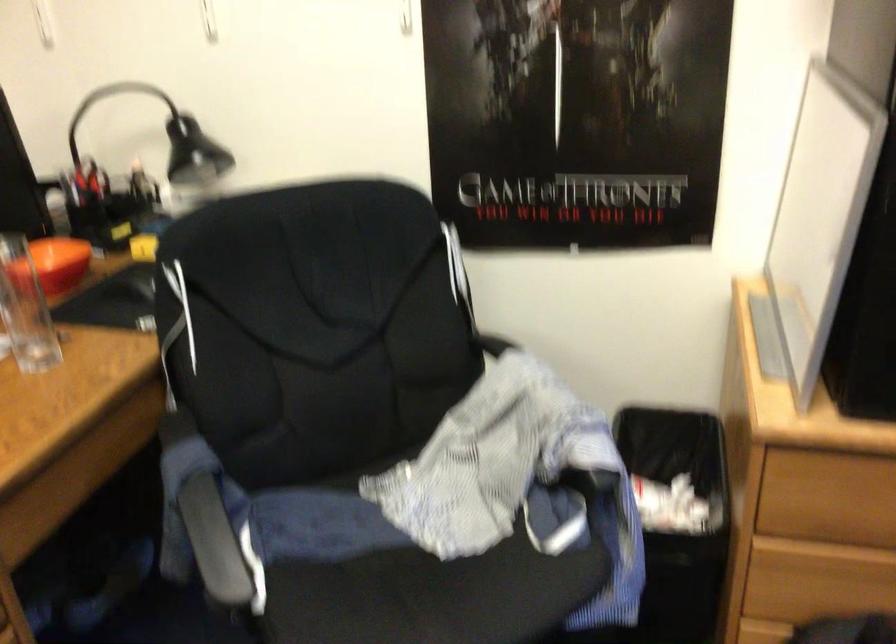
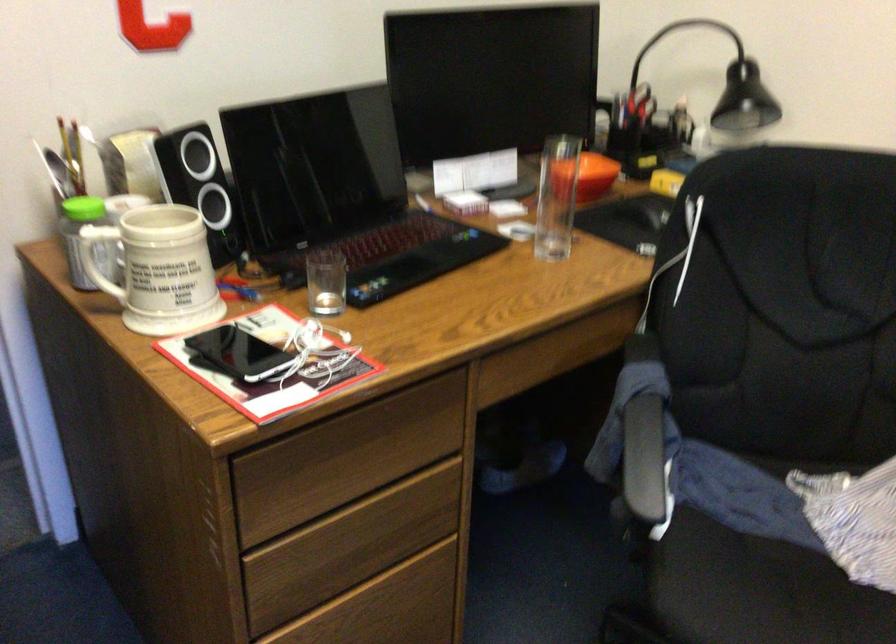
Where in the second image is the point corresponding to (138,285) from the first image?

(647, 210)